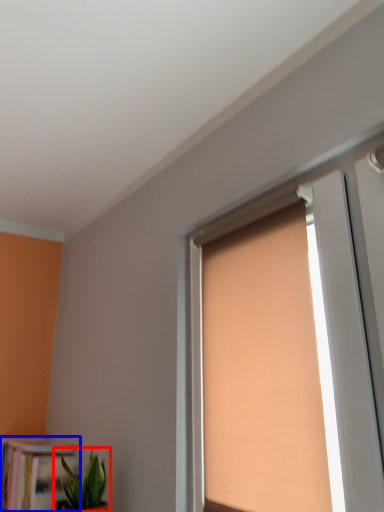
Question: Which object is closer to the camera taking this photo, houseplant (highlighted by a red box) or bookcase (highlighted by a blue box)?

Choices:
 (A) houseplant
 (B) bookcase

Answer: (A)